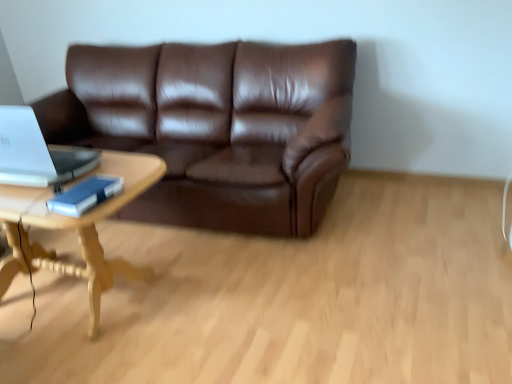
Question: Relative to brown leather couch at center, is light wood/woodencoffee table at left in front or behind?

Choices:
 (A) front
 (B) behind

Answer: (A)

Question: From the image's perspective, is light wood/woodencoffee table at left located above or below brown leather couch at center?

Choices:
 (A) below
 (B) above

Answer: (A)

Question: Estimate the real-world distances between objects in this image. Which object is closer to the brown leather couch at center?

Choices:
 (A) blue matte book at left
 (B) light wood/woodencoffee table at left
 (C) silver metallic laptop at left

Answer: (B)

Question: Estimate the real-world distances between objects in this image. Which object is closer to the light wood/woodencoffee table at left?

Choices:
 (A) brown leather couch at center
 (B) blue matte book at left
 (C) silver metallic laptop at left

Answer: (C)